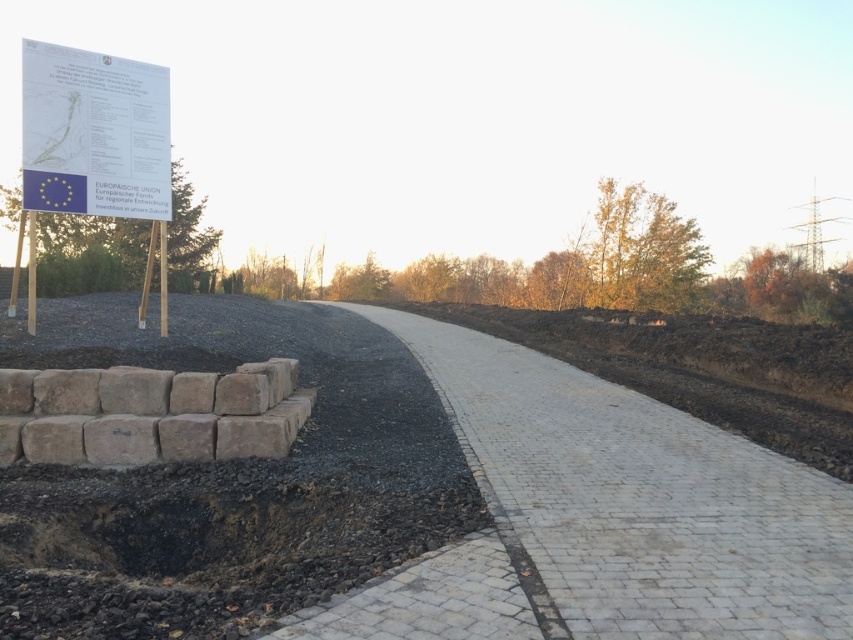
Question: From the image, what is the correct spatial relationship of black gravel at lower left in relation to white brick pavement at center?

Choices:
 (A) right
 (B) left

Answer: (B)

Question: Which of the following is the farthest from the observer?

Choices:
 (A) brown stone wall at lower left
 (B) white brick pavement at center
 (C) black gravel at lower left
 (D) white paper sign at upper left

Answer: (D)

Question: Which object appears farthest from the camera in this image?

Choices:
 (A) black gravel at lower left
 (B) white paper sign at upper left
 (C) white brick pavement at center
 (D) brown stone wall at lower left

Answer: (B)

Question: Can you confirm if brown stone wall at lower left is thinner than white paper sign at upper left?

Choices:
 (A) no
 (B) yes

Answer: (A)

Question: Which object is farther from the camera taking this photo?

Choices:
 (A) white paper sign at upper left
 (B) white brick pavement at center

Answer: (A)

Question: Is black gravel at lower left wider than white brick pavement at center?

Choices:
 (A) yes
 (B) no

Answer: (A)